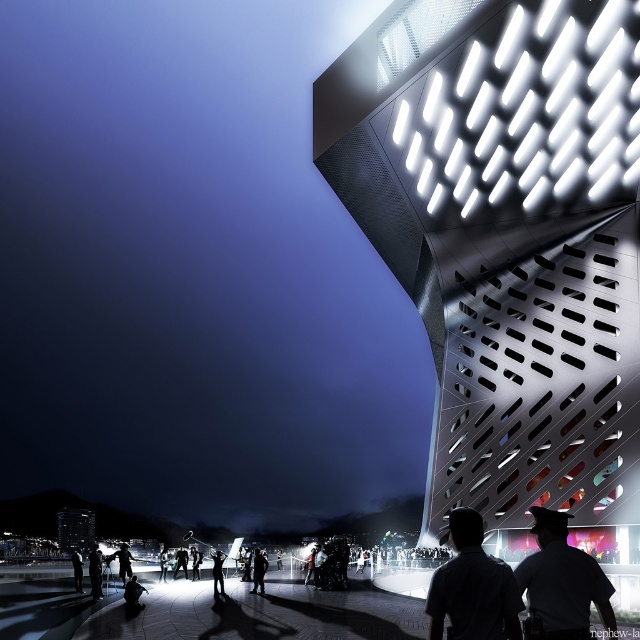
Who is lower down, dark gray fabric shirt at center or silhouette uniformed officer at center?

silhouette uniformed officer at center is below.

Is dark gray fabric shirt at center smaller than silhouette uniformed officer at center?

Yes.

Describe the element at coordinates (472, 588) in the screenshot. I see `dark gray fabric shirt at center` at that location.

What are the coordinates of `dark gray fabric shirt at center` in the screenshot? It's located at (472, 588).

Who is positioned more to the right, dark gray fabric shirt at center or dark gray fabric jacket at lower left?

dark gray fabric shirt at center

Which is in front, point (496, 573) or point (97, 550)?

Point (496, 573)

Identify the location of dark gray fabric shirt at center. The width and height of the screenshot is (640, 640). (472, 588).

Image resolution: width=640 pixels, height=640 pixels. Describe the element at coordinates (563, 580) in the screenshot. I see `silhouette uniformed officer at center` at that location.

Does point (588, 634) come closer to viewer compared to point (100, 557)?

Yes, it is in front of point (100, 557).

Who is more forward, (586,612) or (99,563)?

Positioned in front is point (586,612).

Identify the location of silhouette uniformed officer at center. The width and height of the screenshot is (640, 640). (563, 580).